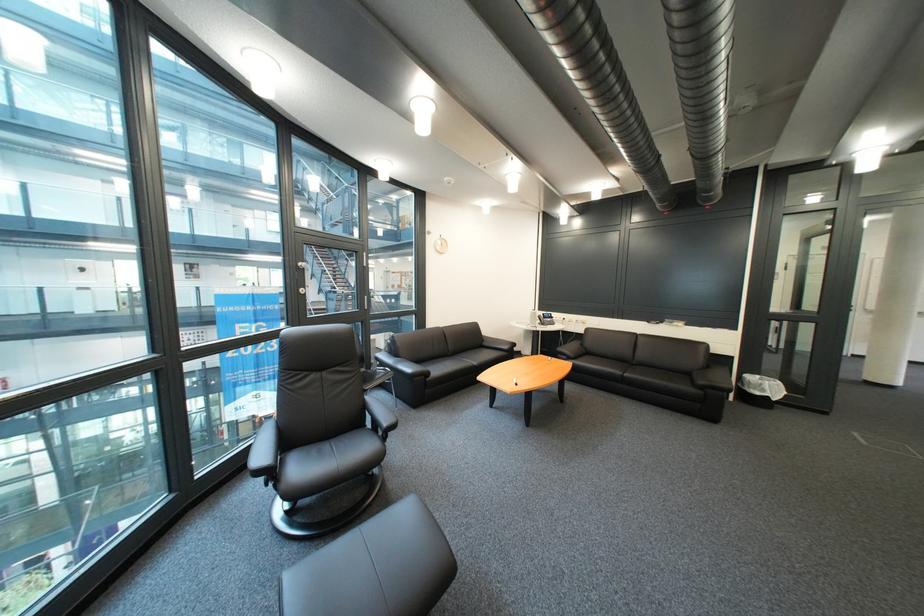
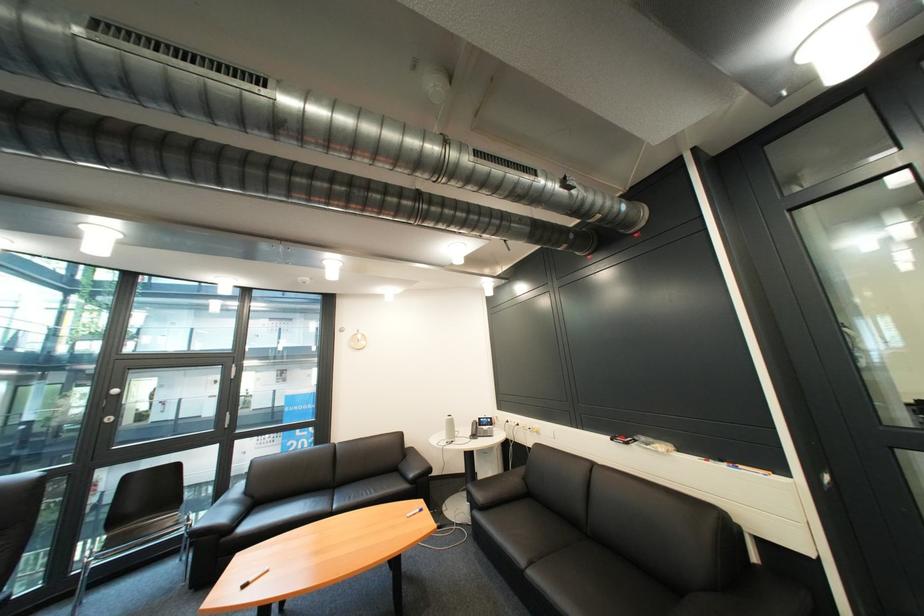
Locate, in the second image, the point that corresponds to point (723, 331) in the first image.

(736, 468)